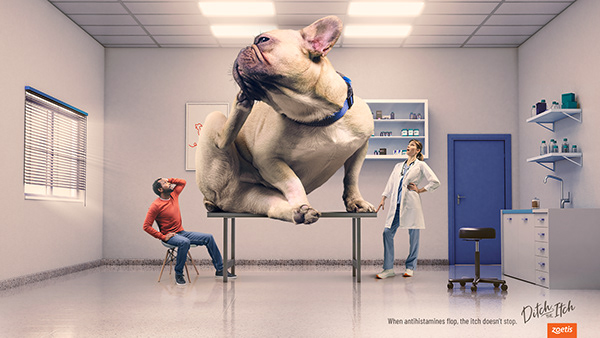
Find the location of a particular element. The image size is (600, 338). window is located at coordinates (56, 140).